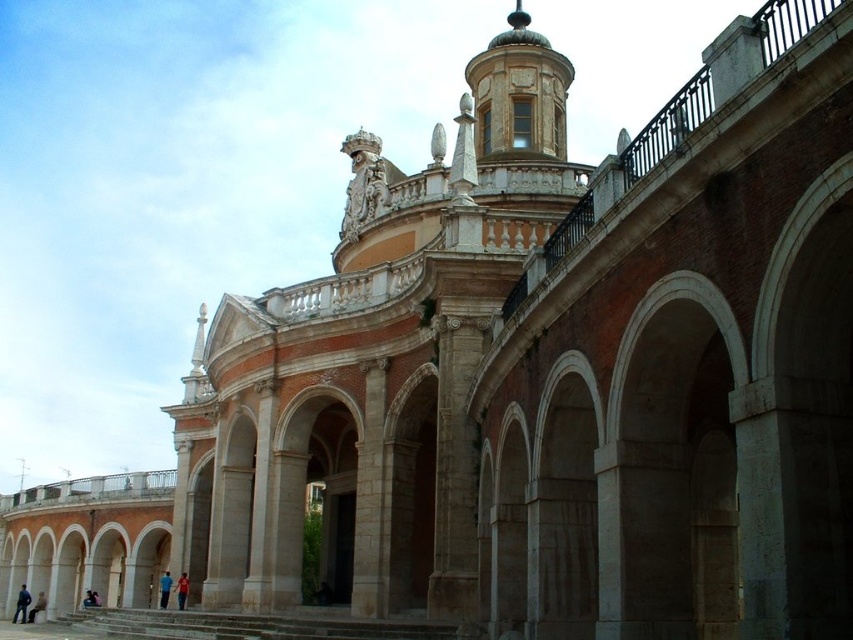
You are standing in front of the grand architectural structure described. You see a blue fabric person at lower center. Based on their position, where would you estimate them to be located relative to the building?

The blue fabric person at lower center is positioned at the lower central area of the image, which corresponds to being near the base of the building, likely in front of the colonnade of arches and columns.

You are standing in front of the grand building and want to take a photo. You notice two points marked on the building. The first point is at coordinate point(20, 620) and the second is at point(183, 582). Which point is closer to your camera lens?

Point(20, 620) is further to the camera than point(183, 582), so the point closer to the camera lens is point(183, 582).

You are standing in front of the grand building and see a blue fabric person at lower center and a red shirt at lower center. Which one is closer to the ground?

The blue fabric person at lower center is closer to the ground since it is located below the red shirt at lower center.